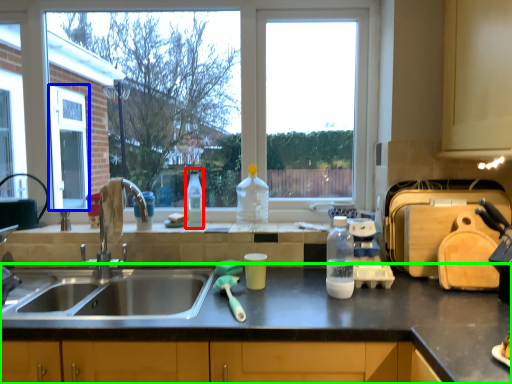
Question: Which object is the closest to the bottle (highlighted by a red box)? Choose among these: screen door (highlighted by a blue box) or countertop (highlighted by a green box).

Choices:
 (A) screen door
 (B) countertop

Answer: (B)